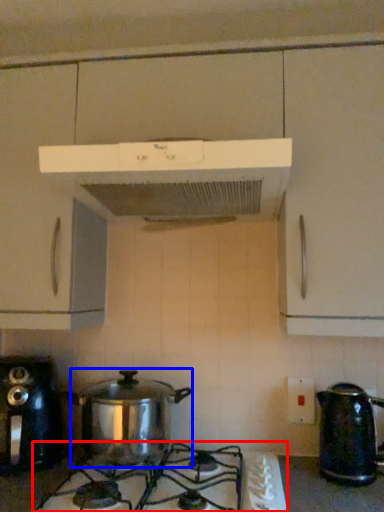
Question: Which object appears closest to the camera in this image, gas stove (highlighted by a red box) or crock pot (highlighted by a blue box)?

Choices:
 (A) gas stove
 (B) crock pot

Answer: (A)